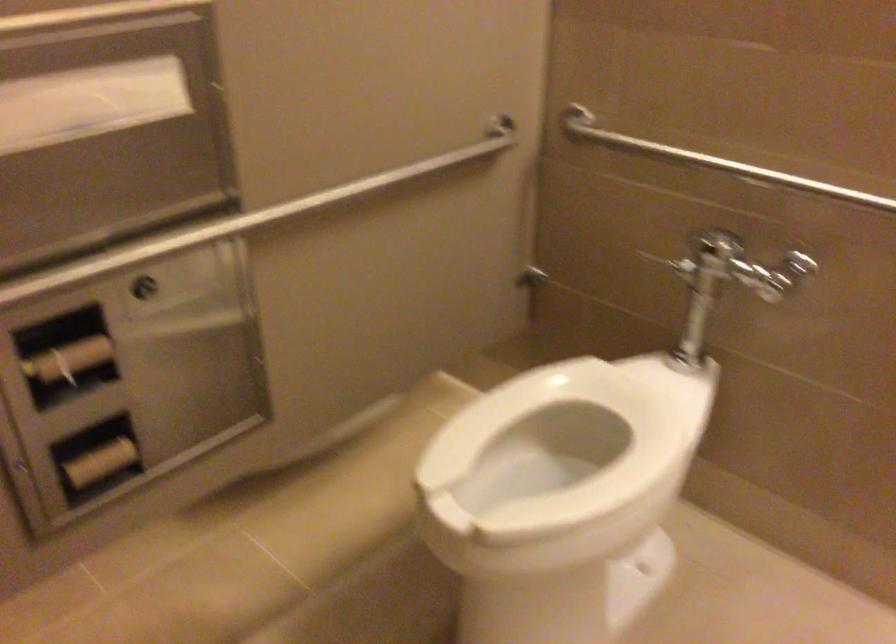
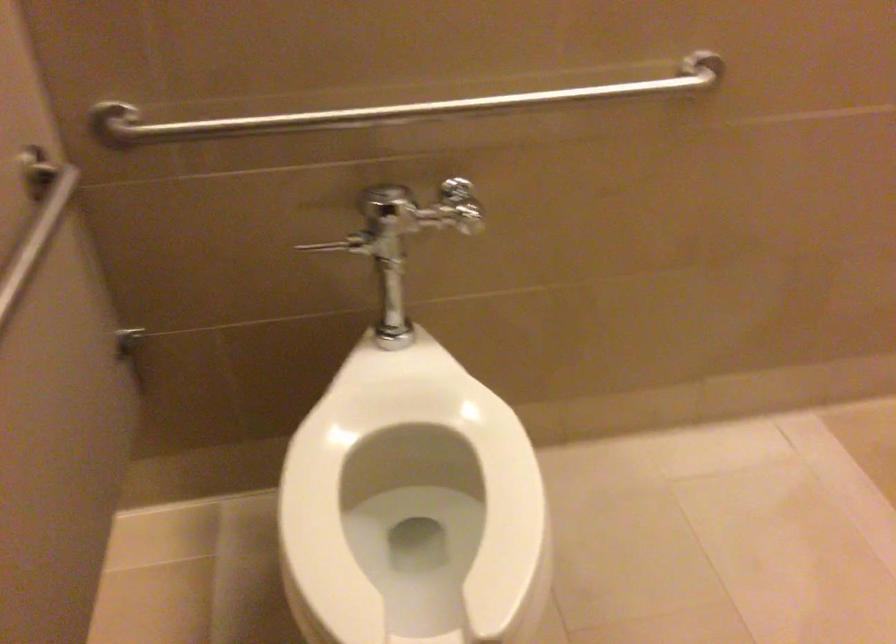
Question: The camera is either moving clockwise (left) or counter-clockwise (right) around the object. The first image is from the beginning of the video and the second image is from the end. Is the camera moving left or right when shooting the video?

Choices:
 (A) Left
 (B) Right

Answer: (A)